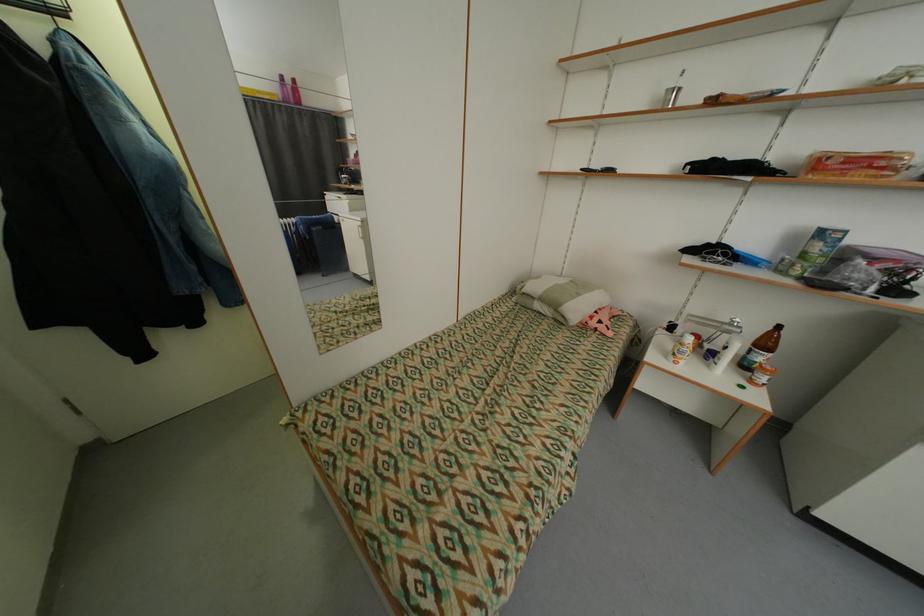
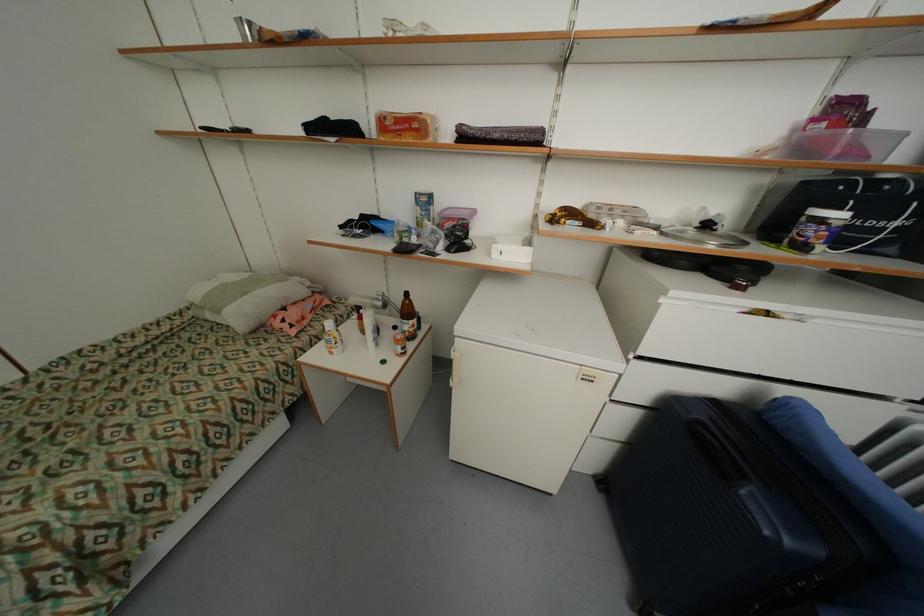
Find the pixel in the second image that matches the point at 889,164 in the first image.

(421, 126)